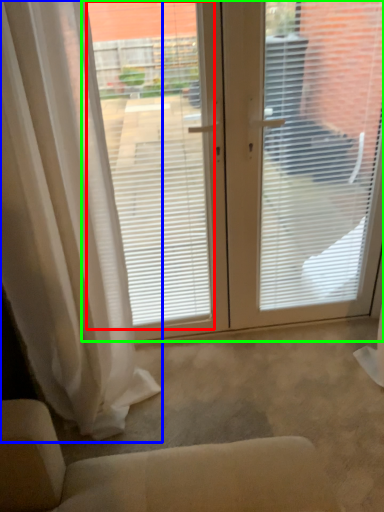
Question: Based on their relative distances, which object is farther from window screen (highlighted by a red box)? Choose from curtain (highlighted by a blue box) and window screen (highlighted by a green box).

Choices:
 (A) curtain
 (B) window screen

Answer: (A)